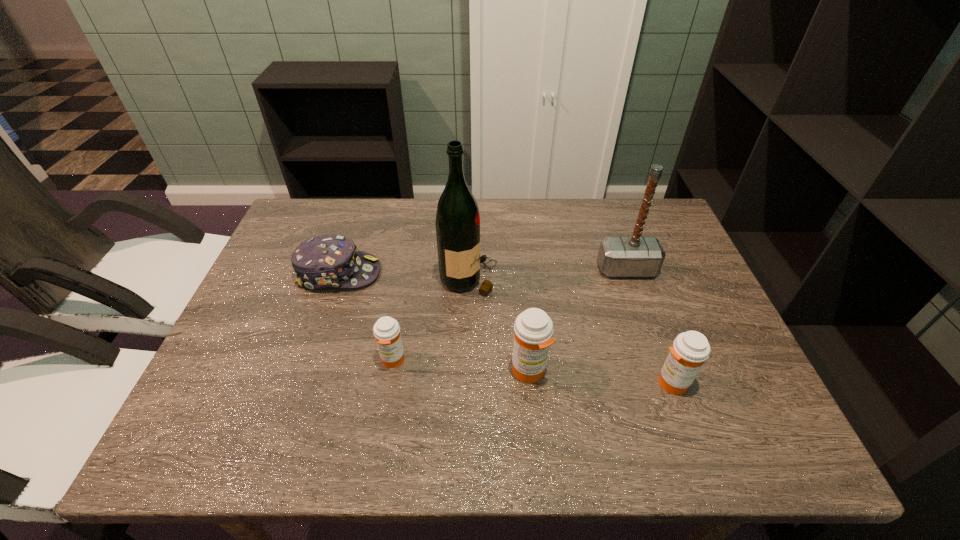
Please show where to add a medicine on the left while keeping spacing even. Please provide its 2D coordinates. Your answer should be formatted as a tuple, i.e. [(x, y)], where the tuple contains the x and y coordinates of a point satisfying the conditions above.

[(262, 349)]